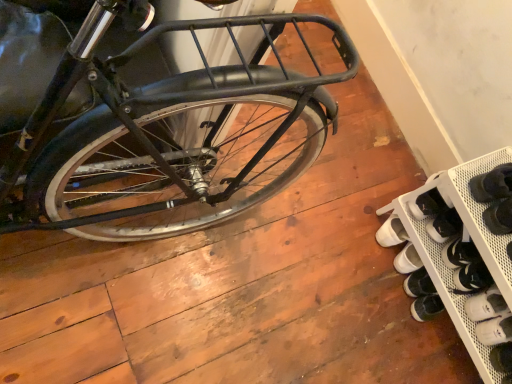
Question: In terms of size, does white matte shoe at lower right appear bigger or smaller than white mesh shoe rack at lower right?

Choices:
 (A) small
 (B) big

Answer: (A)

Question: From a real-world perspective, relative to white mesh shoe rack at lower right, is white matte shoe at lower right vertically above or below?

Choices:
 (A) above
 (B) below

Answer: (B)

Question: Is point (510, 317) closer or farther from the camera than point (475, 187)?

Choices:
 (A) farther
 (B) closer

Answer: (A)

Question: Does point (467, 236) appear closer or farther from the camera than point (508, 322)?

Choices:
 (A) closer
 (B) farther

Answer: (A)

Question: From a real-world perspective, is white mesh shoe rack at lower right positioned above or below white matte shoe at lower right?

Choices:
 (A) above
 (B) below

Answer: (A)

Question: In the image, is white mesh shoe rack at lower right on the left side or the right side of white matte shoe at lower right?

Choices:
 (A) left
 (B) right

Answer: (A)

Question: Is white mesh shoe rack at lower right situated inside white matte shoe at lower right or outside?

Choices:
 (A) inside
 (B) outside

Answer: (B)